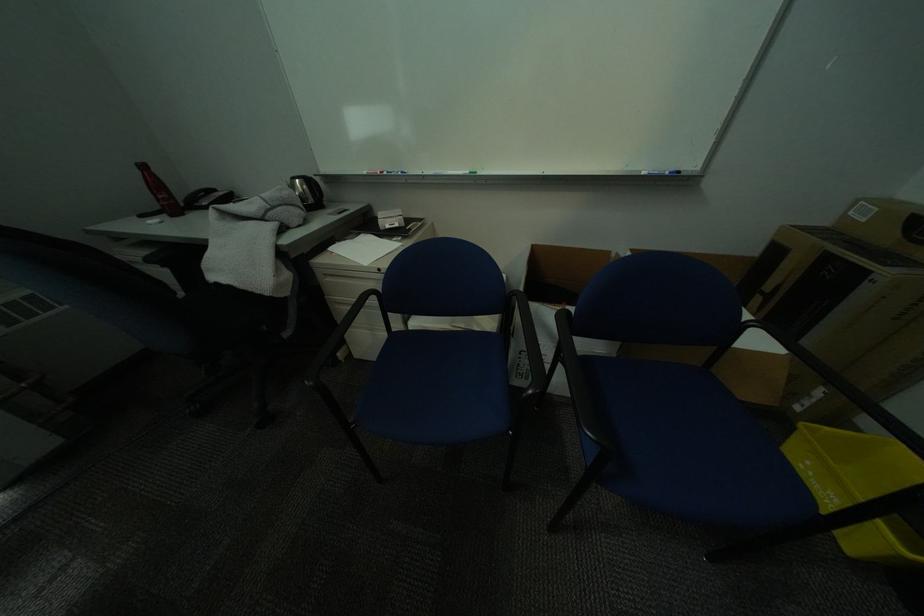
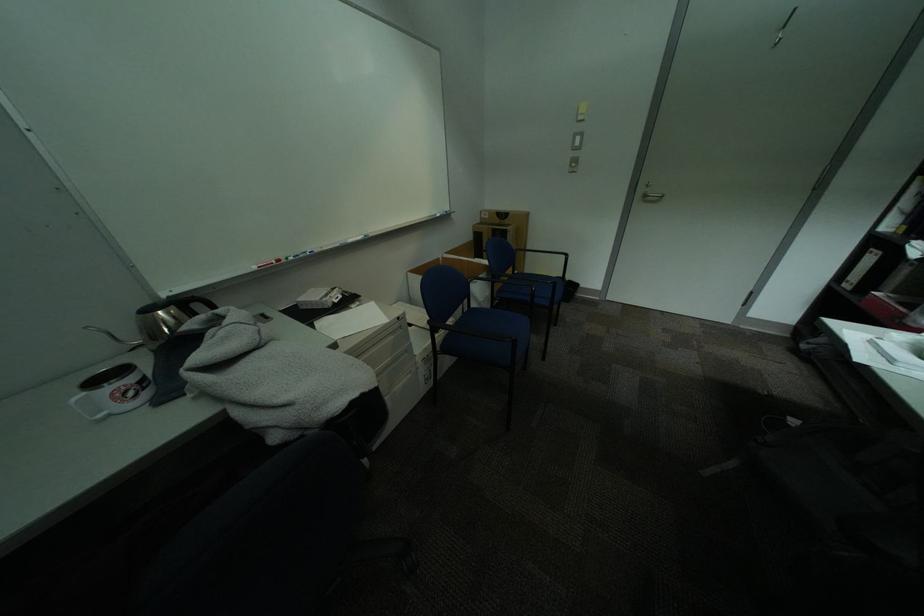
Where in the second image is the point corresponding to the point at 804,227 from the first image?

(487, 225)